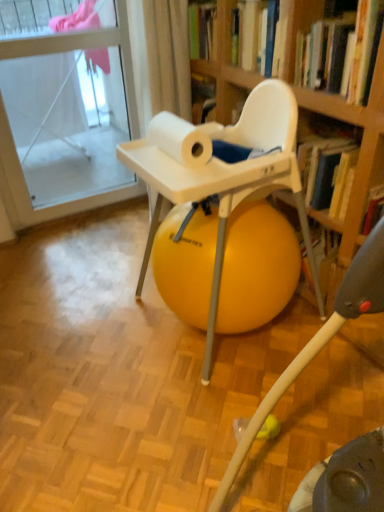
In order to face white matte paper towel at upper center, should I rotate leftwards or rightwards?

A 1.869 degree turn to the left will do.

This screenshot has width=384, height=512. Describe the element at coordinates (340, 51) in the screenshot. I see `hardcover book at upper right` at that location.

Locate an element on the screen. yellow rubber ball at center is located at coordinates (222, 172).

Image resolution: width=384 pixels, height=512 pixels. Find the location of `white matte paper towel at upper center`. white matte paper towel at upper center is located at coordinates (180, 139).

Can you confirm if white matte paper towel at upper center is bigger than yellow rubber ball at center?

Incorrect, white matte paper towel at upper center is not larger than yellow rubber ball at center.

Is white matte paper towel at upper center in front of or behind yellow rubber ball at center in the image?

Clearly, white matte paper towel at upper center is behind yellow rubber ball at center.

Which object is wider, white matte paper towel at upper center or yellow rubber ball at center?

yellow rubber ball at center is wider.

Is the surface of white matte paper towel at upper center in direct contact with yellow rubber ball at center?

No, white matte paper towel at upper center is not touching yellow rubber ball at center.

In terms of height, does yellow rubber ball at center look taller or shorter compared to yellow rubber ball at center?

Considering their sizes, yellow rubber ball at center has more height than yellow rubber ball at center.

Find the location of a particular element. The image size is (384, 512). chair located above the yellow rubber ball at center (from the image's perspective) is located at coordinates (222, 172).

Which of these two, yellow rubber ball at center or yellow rubber ball at center, is thinner?

With smaller width is yellow rubber ball at center.

Consider the image. Is yellow rubber ball at center spatially inside hardcover book at upper right, or outside of it?

yellow rubber ball at center exists outside the volume of hardcover book at upper right.

Does yellow rubber ball at center have a lesser height compared to hardcover book at upper right?

No, yellow rubber ball at center is not shorter than hardcover book at upper right.

Is yellow rubber ball at center in contact with hardcover book at upper right?

yellow rubber ball at center and hardcover book at upper right are clearly separated.

From the image's perspective, which one is positioned higher, yellow rubber ball at center or white matte paper towel at upper center?

white matte paper towel at upper center, from the image's perspective.

Which is more to the left, yellow rubber ball at center or white matte paper towel at upper center?

white matte paper towel at upper center is more to the left.

Looking at this image, could you tell me if yellow rubber ball at center is turned towards white matte paper towel at upper center?

No, yellow rubber ball at center is not aimed at white matte paper towel at upper center.

In terms of size, does yellow rubber ball at center appear bigger or smaller than white matte paper towel at upper center?

Clearly, yellow rubber ball at center is larger in size than white matte paper towel at upper center.

From the image's perspective, between transparent glass door at upper left and hardcover book at upper right, which one is located above?

transparent glass door at upper left, from the image's perspective.

Which is further, (97, 147) or (322, 70)?

The point (97, 147) is more distant.

Is transparent glass door at upper left in contact with hardcover book at upper right?

No, transparent glass door at upper left is not next to hardcover book at upper right.

From a real-world perspective, is yellow rubber ball at center located higher than transparent glass door at upper left?

No.

From the image's perspective, which is below, yellow rubber ball at center or transparent glass door at upper left?

From the image's view, yellow rubber ball at center is below.

In the scene shown: Could you tell me if yellow rubber ball at center is facing transparent glass door at upper left?

No, yellow rubber ball at center is not aimed at transparent glass door at upper left.

In the scene shown: What's the angular difference between yellow rubber ball at center and transparent glass door at upper left's facing directions?

There is a 0.419-degree angle between the facing directions of yellow rubber ball at center and transparent glass door at upper left.

Who is smaller, hardcover book at upper right or yellow rubber ball at center?

hardcover book at upper right is smaller.

Does hardcover book at upper right have a greater height compared to yellow rubber ball at center?

No.

Is point (337, 20) less distant than point (245, 440)?

No.

Where is `feeding chair below the white matte paper towel at upper center (from the image's perspective)`? feeding chair below the white matte paper towel at upper center (from the image's perspective) is located at coordinates (319, 341).

Locate an element on the screen. chair lying behind the yellow rubber ball at center is located at coordinates (222, 172).

Looking at the image, which one is located closer to hardcover book at upper right, yellow rubber ball at center or white matte paper towel at upper center?

The object closer to hardcover book at upper right is white matte paper towel at upper center.

From the image, which object appears to be farther from transparent glass door at upper left, hardcover book at upper right or yellow rubber ball at center?

hardcover book at upper right is positioned further to the anchor transparent glass door at upper left.

Looking at the image, which one is located further to hardcover book at upper right, transparent glass door at upper left or yellow rubber ball at center?

transparent glass door at upper left lies further to hardcover book at upper right than the other object.

When comparing their distances from white matte paper towel at upper center, does yellow rubber ball at center or yellow rubber ball at center seem closer?

Based on the image, yellow rubber ball at center appears to be nearer to white matte paper towel at upper center.

Considering their positions, is transparent glass door at upper left positioned closer to white matte paper towel at upper center than yellow rubber ball at center?

Based on the image, yellow rubber ball at center appears to be nearer to white matte paper towel at upper center.

Based on their spatial positions, is hardcover book at upper right or white matte paper towel at upper center closer to transparent glass door at upper left?

white matte paper towel at upper center is closer to transparent glass door at upper left.

Estimate the real-world distances between objects in this image. Which object is further from yellow rubber ball at center, white matte paper towel at upper center or transparent glass door at upper left?

transparent glass door at upper left lies further to yellow rubber ball at center than the other object.

From the image, which object appears to be nearer to yellow rubber ball at center, yellow rubber ball at center or white matte paper towel at upper center?

Based on the image, white matte paper towel at upper center appears to be nearer to yellow rubber ball at center.

Locate an element on the screen. This screenshot has width=384, height=512. chair between hardcover book at upper right and yellow rubber ball at center in the up-down direction is located at coordinates (222, 172).

At what (x,y) coordinates should I click in order to perform the action: click on paper towel between hardcover book at upper right and yellow rubber ball at center from top to bottom. Please return your answer as a coordinate pair (x, y). This screenshot has width=384, height=512. Looking at the image, I should click on (180, 139).

Where is `paper towel between yellow rubber ball at center and transparent glass door at upper left from front to back`? Image resolution: width=384 pixels, height=512 pixels. paper towel between yellow rubber ball at center and transparent glass door at upper left from front to back is located at coordinates (180, 139).

In order to click on chair between yellow rubber ball at center and white matte paper towel at upper center in the front-back direction in this screenshot , I will do `click(222, 172)`.